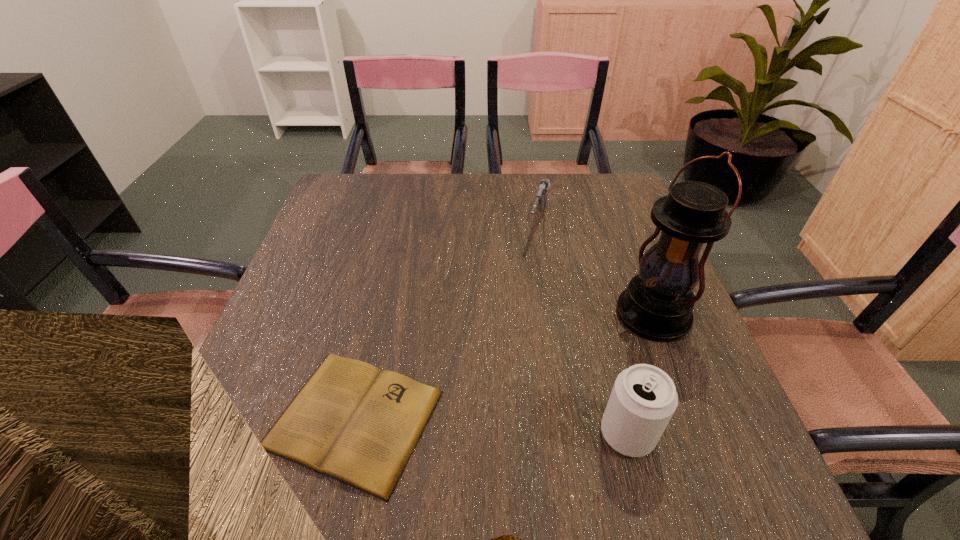
Give me the position of a free location located above the tallest object, indicating its light source. Please provide its 2D coordinates. Your answer should be formatted as a tuple, i.e. [(x, y)], where the tuple contains the x and y coordinates of a point satisfying the conditions above.

[(566, 361)]

Find several locations within the vacant space located above the tallest object, indicating its light source. Please provide its 2D coordinates. Your answer should be formatted as a tuple, i.e. [(x, y)], where the tuple contains the x and y coordinates of a point satisfying the conditions above.

[(496, 400)]

Locate an element on the screen. vacant space located at the barrel of the second shortest object is located at coordinates (507, 342).

Identify the location of vacant space positioned at the barrel of the second shortest object. (500, 361).

Where is `free space located at the barrel of the second shortest object`? This screenshot has height=540, width=960. free space located at the barrel of the second shortest object is located at coordinates (510, 332).

Image resolution: width=960 pixels, height=540 pixels. I want to click on object that is at the far edge, so click(x=541, y=199).

What are the coordinates of `book that is at the near edge` in the screenshot? It's located at (351, 421).

The image size is (960, 540). Find the location of `can at the near edge`. can at the near edge is located at coordinates (643, 399).

This screenshot has width=960, height=540. Find the location of `object that is at the left edge`. object that is at the left edge is located at coordinates (x=351, y=421).

You are a GUI agent. You are given a task and a screenshot of the screen. Output one action in this format:
    pyautogui.click(x=<x>, y=<y>)
    Task: Click on the can present at the right edge
    
    Given the screenshot: What is the action you would take?
    pyautogui.click(x=643, y=399)